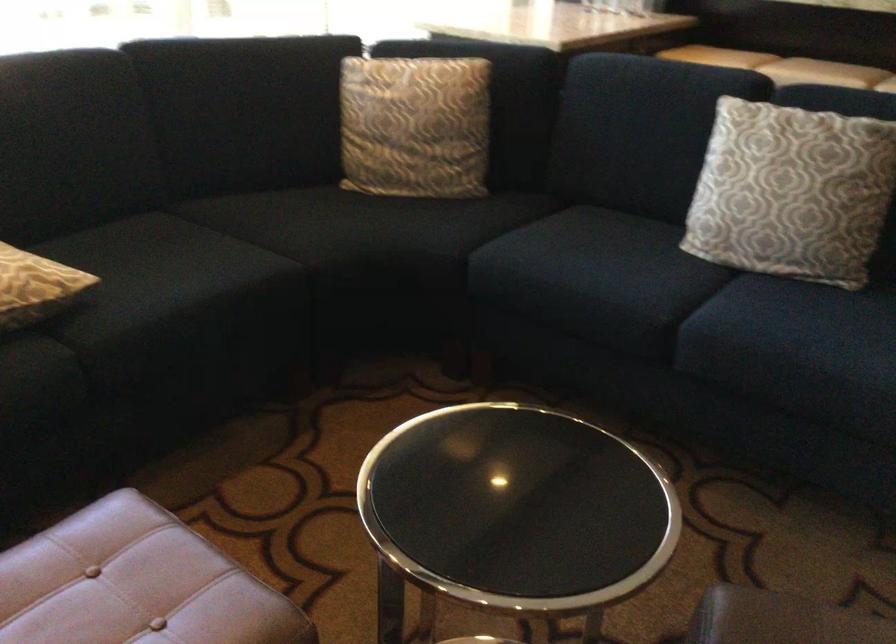
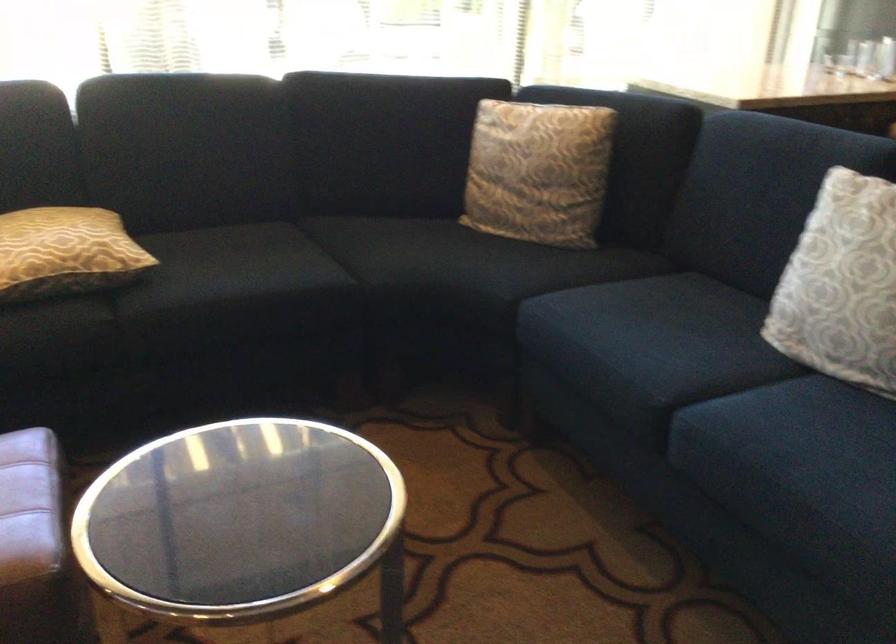
Locate, in the second image, the point that corresponds to point (313, 237) in the first image.

(391, 261)